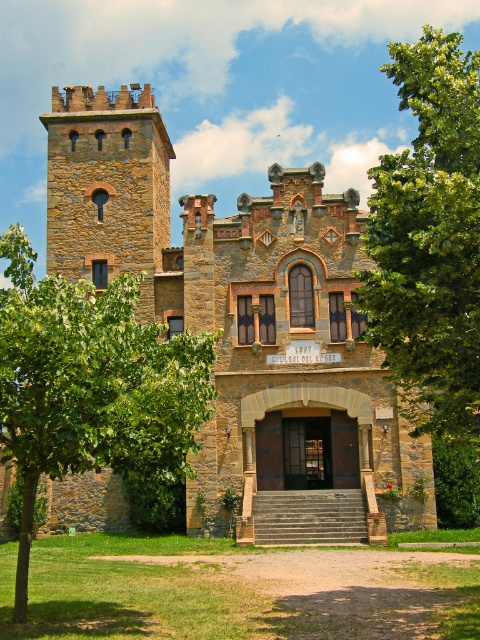
Question: Is green leafy tree at upper right closer to camera compared to rustic stone tower at upper left?

Choices:
 (A) yes
 (B) no

Answer: (A)

Question: From the image, what is the correct spatial relationship of brown stone castle at center in relation to rustic stone tower at upper left?

Choices:
 (A) right
 (B) left

Answer: (A)

Question: Which of the following is the farthest from the observer?

Choices:
 (A) green leafy tree at center
 (B) brown stone castle at center

Answer: (B)

Question: Among these points, which one is farthest from the camera?

Choices:
 (A) (210, 234)
 (B) (100, 412)
 (C) (436, 432)

Answer: (A)

Question: Is green leafy tree at center below green leafy tree at upper right?

Choices:
 (A) no
 (B) yes

Answer: (B)

Question: Which point is farther to the camera?

Choices:
 (A) green leafy tree at center
 (B) rustic stone tower at upper left
 (C) green leafy tree at upper right
 (D) brown stone castle at center

Answer: (B)